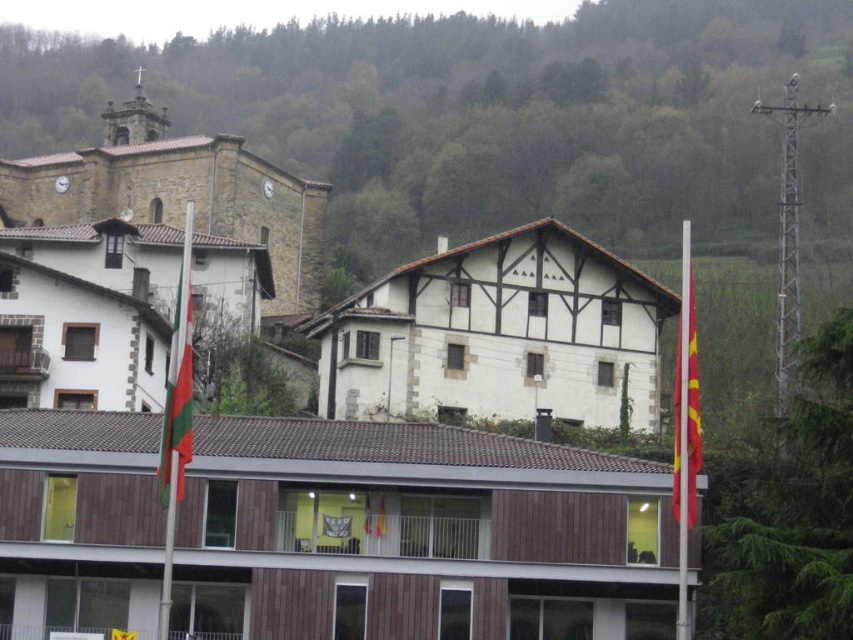
Question: Which object is closer to the camera taking this photo?

Choices:
 (A) red fabric flag at right
 (B) white wooden building at upper left

Answer: (A)

Question: Is white wood house at center smaller than green and white striped flag at left?

Choices:
 (A) yes
 (B) no

Answer: (B)

Question: Is brown wooden building at center above white wood hotel at upper left?

Choices:
 (A) no
 (B) yes

Answer: (A)

Question: Which point appears closest to the camera in this image?

Choices:
 (A) (257, 436)
 (B) (102, 168)
 (C) (688, 403)

Answer: (C)

Question: Which of these objects is positioned farthest from the white wood hotel at upper left?

Choices:
 (A) white wood house at center
 (B) brown wooden building at center
 (C) white wooden building at upper left

Answer: (C)

Question: From the image, what is the correct spatial relationship of white wood house at center in relation to green and white striped flag at left?

Choices:
 (A) above
 (B) below

Answer: (A)